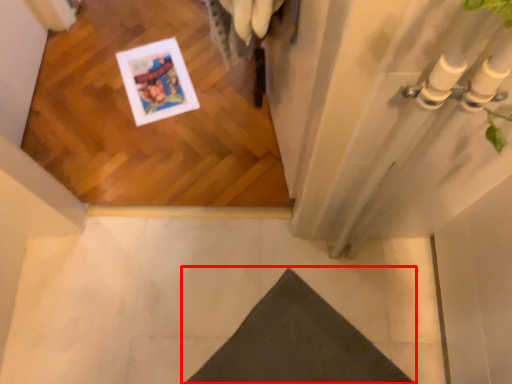
Question: Considering the relative positions of doormat (annotated by the red box) and concrete in the image provided, where is doormat (annotated by the red box) located with respect to the staircase?

Choices:
 (A) right
 (B) left

Answer: (A)